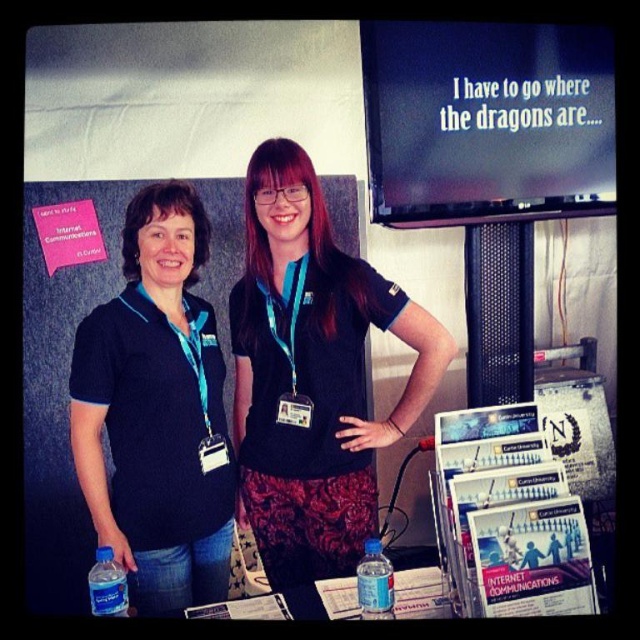
Question: Which point is closer to the camera?

Choices:
 (A) teal fabric lanyard at center
 (B) metallic badge at center

Answer: (A)

Question: Which point is farther to the camera?

Choices:
 (A) matte black shirt at left
 (B) blue plastic water bottle at lower left

Answer: (A)

Question: Is matte black shirt at center bigger than blue plastic water bottle at lower left?

Choices:
 (A) yes
 (B) no

Answer: (A)

Question: Can you confirm if matte black shirt at center is positioned below blue plastic water bottle at lower left?

Choices:
 (A) no
 (B) yes

Answer: (A)

Question: Which point appears farthest from the camera in this image?

Choices:
 (A) (193, 352)
 (B) (371, 600)
 (C) (99, 552)
 (D) (289, 413)

Answer: (A)

Question: Where is teal fabric lanyard at left located in relation to blue plastic water bottle at lower center in the image?

Choices:
 (A) right
 (B) left

Answer: (B)